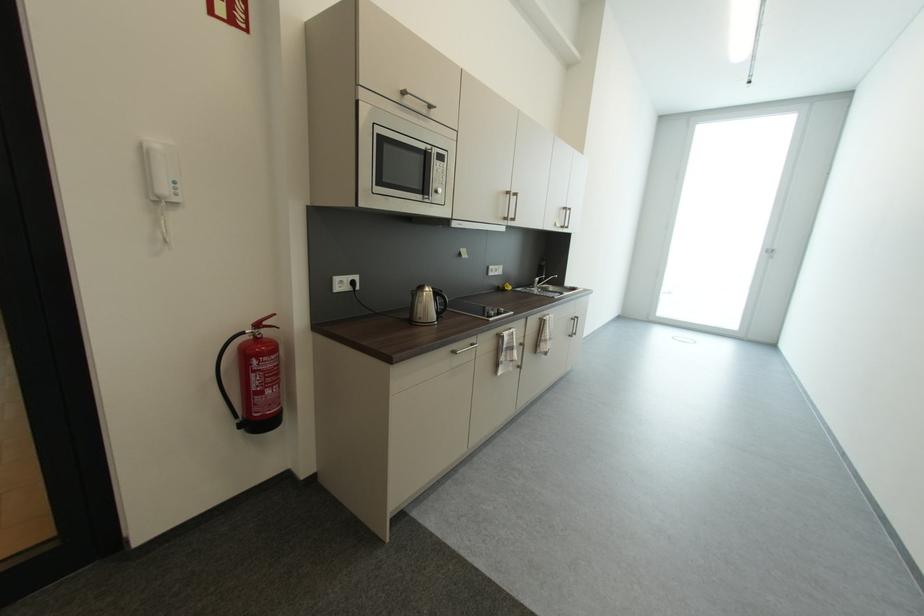
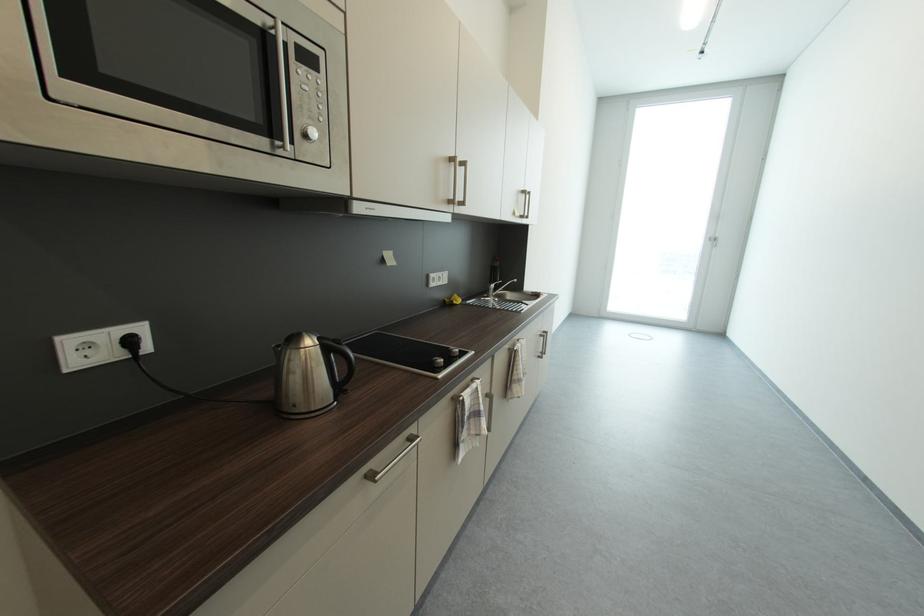
The point at (543, 281) is marked in the first image. Where is the corresponding point in the second image?

(499, 286)